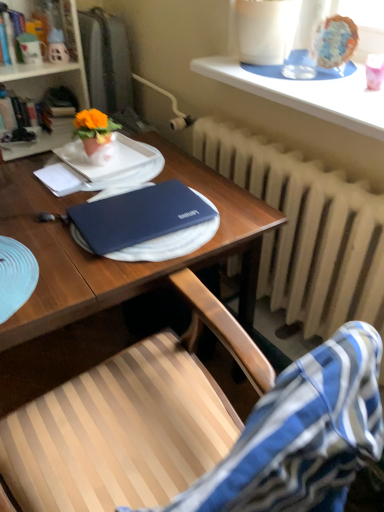
The image size is (384, 512). Find the location of `matte blue laptop at center`. matte blue laptop at center is located at coordinates (109, 278).

What do you see at coordinates (109, 278) in the screenshot? I see `matte blue laptop at center` at bounding box center [109, 278].

The image size is (384, 512). Describe the element at coordinates (13, 30) in the screenshot. I see `matte ceramic mug at upper left` at that location.

What is the approximate width of glazed ceramic cake at upper right?

glazed ceramic cake at upper right is 2.95 inches wide.

Locate an element on the screen. The image size is (384, 512). blue matte laptop at center is located at coordinates (138, 218).

The image size is (384, 512). In order to click on white paper at left in this screenshot , I will do `click(60, 179)`.

Which is more to the right, matte blue laptop at center or blue matte laptop at center?

blue matte laptop at center.

Is point (41, 337) closer to viewer compared to point (117, 200)?

That is False.

From the image's perspective, relative to blue matte laptop at center, is matte blue laptop at center above or below?

matte blue laptop at center is situated lower than blue matte laptop at center in the image.

Is glazed ceramic cake at upper right positioned with its back to matte ceramic gnome at upper left, which ranks as the 2th toy in left-to-right order?

No, glazed ceramic cake at upper right is not facing away from matte ceramic gnome at upper left, which ranks as the 2th toy in left-to-right order.

Between glazed ceramic cake at upper right and matte ceramic gnome at upper left, which is the 1th toy from right to left, which one has less height?

glazed ceramic cake at upper right is shorter.

Could you measure the distance between glazed ceramic cake at upper right and matte ceramic gnome at upper left, which is the 1th toy from right to left?

glazed ceramic cake at upper right and matte ceramic gnome at upper left, which is the 1th toy from right to left, are 3.82 feet apart from each other.

From the image's perspective, is glazed ceramic cake at upper right on top of matte ceramic gnome at upper left, which ranks as the 2th toy in left-to-right order?

No.

Is white matte bookshelf at upper left next to white textured radiator at center and touching it?

No, white matte bookshelf at upper left is not beside white textured radiator at center.

Considering the relative sizes of white matte bookshelf at upper left and white textured radiator at center in the image provided, is white matte bookshelf at upper left bigger than white textured radiator at center?

Correct, white matte bookshelf at upper left is larger in size than white textured radiator at center.

Does white matte bookshelf at upper left lie behind white textured radiator at center?

Yes, white matte bookshelf at upper left is further from the camera.

Is point (110, 125) closer or farther from the camera than point (375, 223)?

Clearly, point (110, 125) is more distant from the camera than point (375, 223).

In the scene shown: Is matte orange flowerpot at upper left facing away from white textured radiator at center?

That's not correct — matte orange flowerpot at upper left is not looking away from white textured radiator at center.

From a real-world perspective, is matte orange flowerpot at upper left beneath white textured radiator at center?

No, from a real-world perspective, matte orange flowerpot at upper left is not under white textured radiator at center.

Based on their positions, is matte orange flowerpot at upper left located to the left or right of white textured radiator at center?

Based on their positions, matte orange flowerpot at upper left is located to the left of white textured radiator at center.

Choose the correct answer: Is white textured radiator at center inside matte ceramic mug at upper left or outside it?

white textured radiator at center lies outside matte ceramic mug at upper left.

From a real-world perspective, is white textured radiator at center located higher than matte ceramic mug at upper left?

Incorrect, from a real-world perspective, white textured radiator at center is lower than matte ceramic mug at upper left.

Which object is further away from the camera, white textured radiator at center or matte ceramic mug at upper left?

matte ceramic mug at upper left is further from the camera.

Does white textured radiator at center have a larger size compared to matte ceramic mug at upper left?

Yes, white textured radiator at center is bigger than matte ceramic mug at upper left.

The height and width of the screenshot is (512, 384). In the image, there is a white matte bookshelf at upper left. Find the location of `desk below it (from the image's perspective)`. desk below it (from the image's perspective) is located at coordinates (109, 278).

Is matte blue laptop at center positioned with its back to white matte bookshelf at upper left?

That's right, matte blue laptop at center is facing away from white matte bookshelf at upper left.

From the image's perspective, is matte blue laptop at center on white matte bookshelf at upper left?

Actually, matte blue laptop at center appears below white matte bookshelf at upper left in the image.

Can we say matte blue laptop at center lies outside white matte bookshelf at upper left?

Indeed, matte blue laptop at center is completely outside white matte bookshelf at upper left.

Measure the distance from white matte bookshelf at upper left to blue matte laptop at center.

3.83 feet.

Is blue matte laptop at center completely or partially inside white matte bookshelf at upper left?

No, blue matte laptop at center is not inside white matte bookshelf at upper left.

I want to click on bookshelf lying behind the blue matte laptop at center, so click(x=53, y=65).

What's the angular difference between white matte bookshelf at upper left and blue matte laptop at center's facing directions?

93.1 degrees separate the facing orientations of white matte bookshelf at upper left and blue matte laptop at center.

What are the coordinates of `laptop located behind the matte blue laptop at center` in the screenshot? It's located at (138, 218).

Where is `food that appears above the matte ceramic gnome at upper left, which is the 1th toy from right to left (from a real-world perspective)`? This screenshot has width=384, height=512. food that appears above the matte ceramic gnome at upper left, which is the 1th toy from right to left (from a real-world perspective) is located at coordinates (334, 41).

Estimate the real-world distances between objects in this image. Which object is closer to matte blue laptop at center, matte ceramic mug at upper left, marked as the 2th toy in a right-to-left arrangement, or matte ceramic gnome at upper left, which ranks as the 2th toy in left-to-right order?

matte ceramic gnome at upper left, which ranks as the 2th toy in left-to-right order, is closer to matte blue laptop at center.

Which object lies nearer to the anchor point matte ceramic gnome at upper left, which ranks as the 2th toy in left-to-right order, white paper at left or blue matte laptop at center?

white paper at left lies closer to matte ceramic gnome at upper left, which ranks as the 2th toy in left-to-right order, than the other object.

From the picture: Considering their positions, is glazed ceramic cake at upper right positioned closer to matte ceramic gnome at upper left, which is the 1th toy from right to left, than white matte bookshelf at upper left?

Among the two, white matte bookshelf at upper left is located nearer to matte ceramic gnome at upper left, which is the 1th toy from right to left.

Which object lies nearer to the anchor point white paper at left, glazed ceramic cake at upper right or matte ceramic gnome at upper left, which is the 1th toy from right to left?

matte ceramic gnome at upper left, which is the 1th toy from right to left.

When comparing their distances from white paper at left, does matte ceramic gnome at upper left, which is the 1th toy from right to left, or matte ceramic mug at upper left, the 1th toy when ordered from left to right, seem closer?

matte ceramic gnome at upper left, which is the 1th toy from right to left, lies closer to white paper at left than the other object.

Estimate the real-world distances between objects in this image. Which object is closer to matte orange flowerpot at upper left, glazed ceramic cake at upper right or matte blue laptop at center?

The object closer to matte orange flowerpot at upper left is matte blue laptop at center.

From the image, which object appears to be farther from white matte bookshelf at upper left, matte ceramic mug at upper left or matte ceramic mug at upper left, marked as the 2th toy in a right-to-left arrangement?

Among the two, matte ceramic mug at upper left, marked as the 2th toy in a right-to-left arrangement, is located further to white matte bookshelf at upper left.

Which object lies nearer to the anchor point matte ceramic mug at upper left, marked as the 2th toy in a right-to-left arrangement, white paper at left or wooden at lower left?

Based on the image, white paper at left appears to be nearer to matte ceramic mug at upper left, marked as the 2th toy in a right-to-left arrangement.

Find the location of a particular element. houseplant between white matte bookshelf at upper left and matte blue laptop at center in the up-down direction is located at coordinates (96, 134).

Where is `food between matte ceramic gnome at upper left, which is the 1th toy from right to left, and matte blue laptop at center vertically`? The height and width of the screenshot is (512, 384). food between matte ceramic gnome at upper left, which is the 1th toy from right to left, and matte blue laptop at center vertically is located at coordinates (334, 41).

Identify the location of radiator located between wooden at lower left and matte ceramic gnome at upper left, which ranks as the 2th toy in left-to-right order, in the depth direction. Image resolution: width=384 pixels, height=512 pixels. (306, 230).

Image resolution: width=384 pixels, height=512 pixels. I want to click on bookshelf between wooden at lower left and matte ceramic mug at upper left in the front-back direction, so click(53, 65).